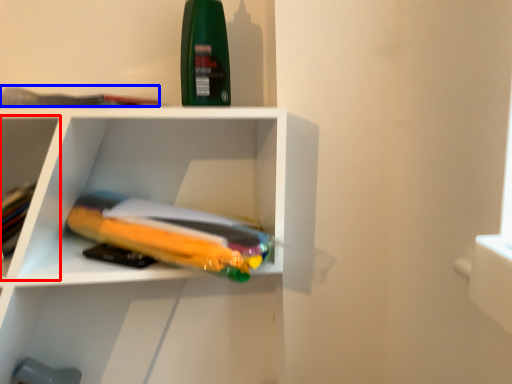
Question: Which of the following is the closest to the observer, shelf (highlighted by a red box) or book (highlighted by a blue box)?

Choices:
 (A) shelf
 (B) book

Answer: (B)